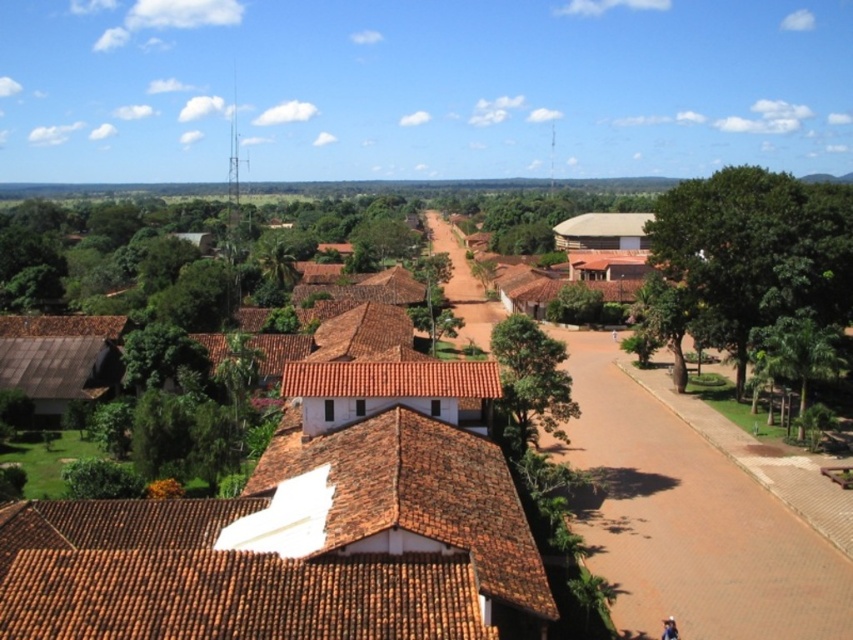
Question: Based on their relative distances, which object is nearer to the brown dirt track at center?

Choices:
 (A) green leafy tree at lower right
 (B) green leafy tree at center
 (C) brown tile roof at center
 (D) green leafy tree at right

Answer: (A)

Question: Which object is positioned closest to the green leafy tree at center?

Choices:
 (A) green leafy tree at right
 (B) green leafy tree at lower right
 (C) brown tile roof at center

Answer: (C)

Question: Does brown tile roof at center come in front of brown dirt track at center?

Choices:
 (A) no
 (B) yes

Answer: (B)

Question: Does brown tile roof at center appear over brown dirt track at center?

Choices:
 (A) no
 (B) yes

Answer: (A)

Question: Estimate the real-world distances between objects in this image. Which object is farther from the green leafy tree at lower right?

Choices:
 (A) green leafy tree at center
 (B) brown dirt track at center

Answer: (A)

Question: Does brown dirt track at center appear over green leafy tree at center?

Choices:
 (A) yes
 (B) no

Answer: (B)